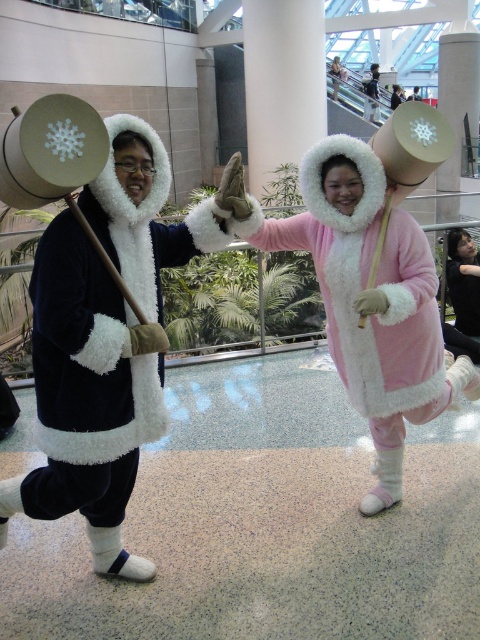
Question: In this image, where is velvet black coat at left located relative to matte pink plush coat at center?

Choices:
 (A) right
 (B) left

Answer: (B)

Question: Does velvet black coat at left appear on the left side of matte pink plush coat at center?

Choices:
 (A) yes
 (B) no

Answer: (A)

Question: Estimate the real-world distances between objects in this image. Which object is farther from the velvet pink dress at center?

Choices:
 (A) velvet black coat at left
 (B) matte pink plush coat at center

Answer: (A)

Question: Does matte pink plush coat at center appear over velvet pink dress at center?

Choices:
 (A) no
 (B) yes

Answer: (A)

Question: Which object is positioned closest to the velvet pink dress at center?

Choices:
 (A) velvet black coat at left
 (B) matte pink plush coat at center

Answer: (B)

Question: Which point appears farthest from the camera in this image?

Choices:
 (A) (387, 419)
 (B) (62, 282)
 (C) (456, 256)

Answer: (C)